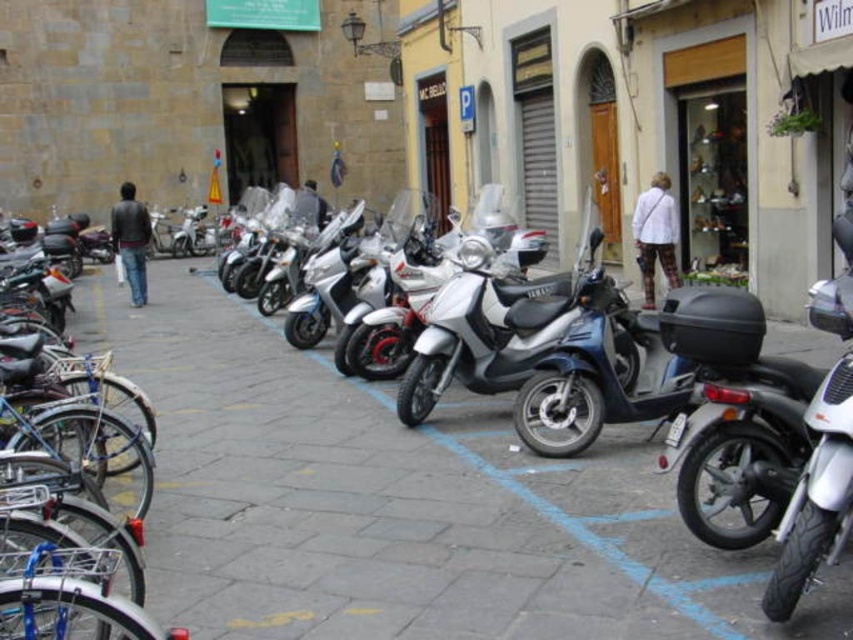
Find the location of a particular element. matte gray pavement at center is located at coordinates (x=398, y=502).

Is point (209, 310) behind point (83, 452)?

Yes, it is.

Which is behind, point (799, 342) or point (32, 445)?

The point (799, 342) is more distant.

Image resolution: width=853 pixels, height=640 pixels. I want to click on matte gray pavement at center, so click(398, 502).

Does matte gray pavement at center have a greater height compared to metallic silver scooter at center?

No, matte gray pavement at center is not taller than metallic silver scooter at center.

Is matte gray pavement at center to the right of metallic silver scooter at center from the viewer's perspective?

Incorrect, matte gray pavement at center is not on the right side of metallic silver scooter at center.

Is point (476, 579) positioned before point (434, 353)?

Yes.

This screenshot has height=640, width=853. I want to click on matte gray pavement at center, so click(x=398, y=502).

Is point (64, 419) farther from camera compared to point (457, 355)?

No.

Can you confirm if blue matte bicycle at left is shorter than metallic silver scooter at center?

Yes.

What do you see at coordinates (73, 512) in the screenshot? I see `blue matte bicycle at left` at bounding box center [73, 512].

Identify the location of blue matte bicycle at left. This screenshot has width=853, height=640. (73, 512).